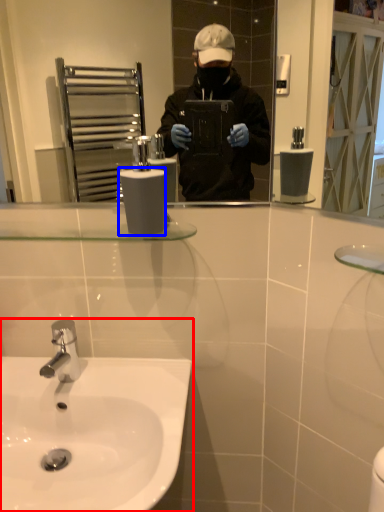
Question: Which object is further to the camera taking this photo, sink (highlighted by a red box) or toilet paper (highlighted by a blue box)?

Choices:
 (A) sink
 (B) toilet paper

Answer: (B)